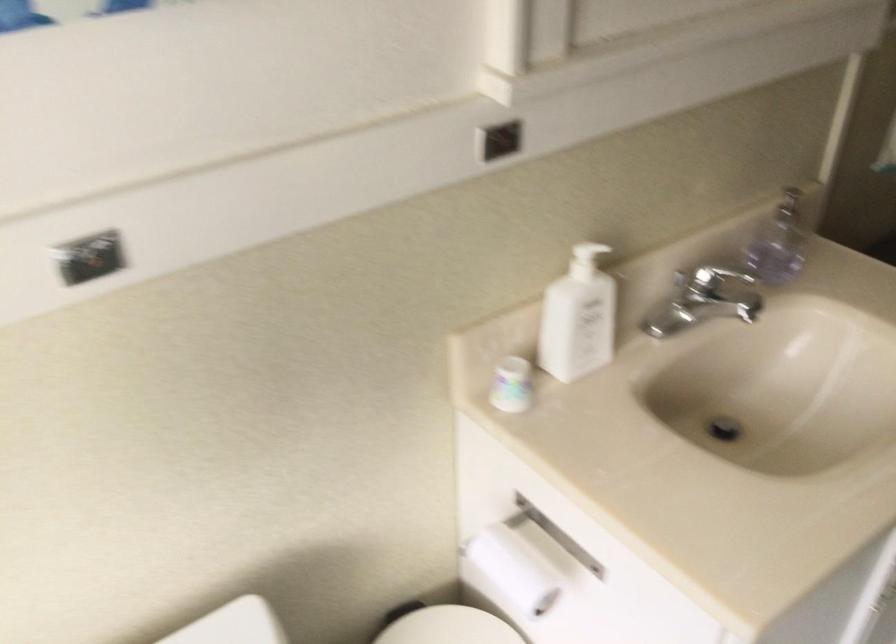
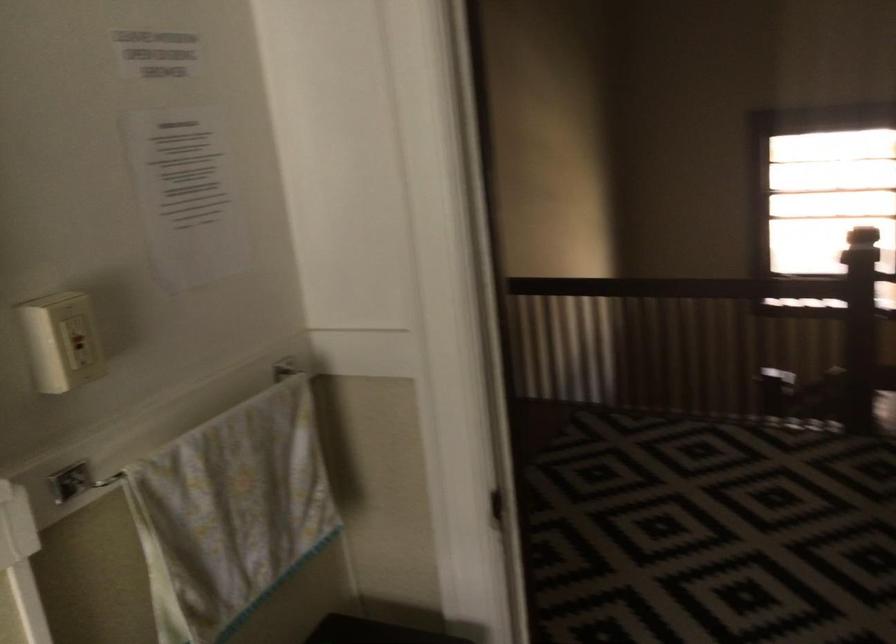
The images are taken continuously from a first-person perspective. In which direction is your viewpoint rotating?

The rotation direction of the camera is right-up.